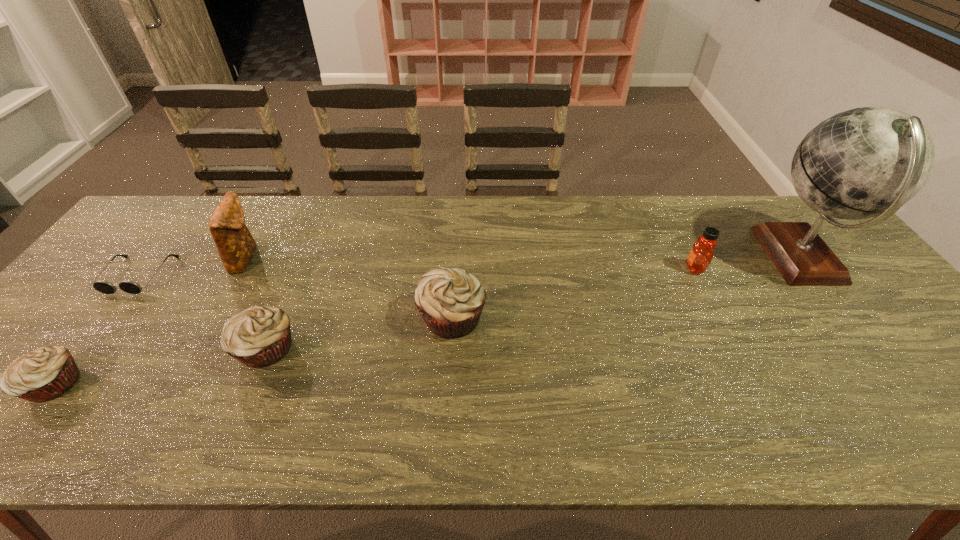
Locate an element on the screen. Image resolution: width=960 pixels, height=540 pixels. the shortest muffin is located at coordinates (44, 374).

This screenshot has width=960, height=540. In order to click on the leftmost muffin in this screenshot , I will do `click(44, 374)`.

Identify the location of the second muffin from left to right. This screenshot has width=960, height=540. (260, 336).

At what (x,y) coordinates should I click in order to perform the action: click on the fourth object from left to right. Please return your answer as a coordinate pair (x, y). The image size is (960, 540). Looking at the image, I should click on (260, 336).

Find the location of a particular element. The width and height of the screenshot is (960, 540). the rightmost muffin is located at coordinates (450, 301).

Locate an element on the screen. Image resolution: width=960 pixels, height=540 pixels. the second object from right to left is located at coordinates (700, 256).

Identify the location of the shortest object. The width and height of the screenshot is (960, 540). (127, 286).

The height and width of the screenshot is (540, 960). I want to click on globe, so click(x=866, y=162).

Locate an element on the screen. The image size is (960, 540). the tallest object is located at coordinates (866, 162).

Locate an element on the screen. the sixth shortest object is located at coordinates (236, 246).